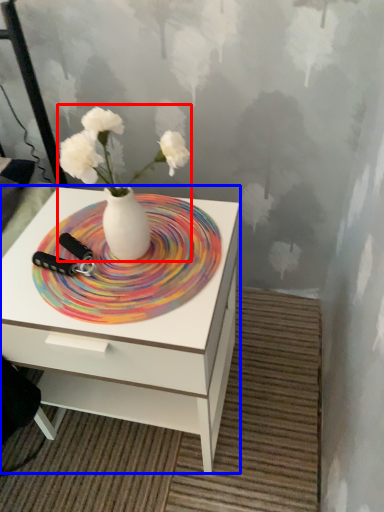
Question: Among these objects, which one is farthest to the camera, floral arrangement (highlighted by a red box) or nightstand (highlighted by a blue box)?

Choices:
 (A) floral arrangement
 (B) nightstand

Answer: (B)